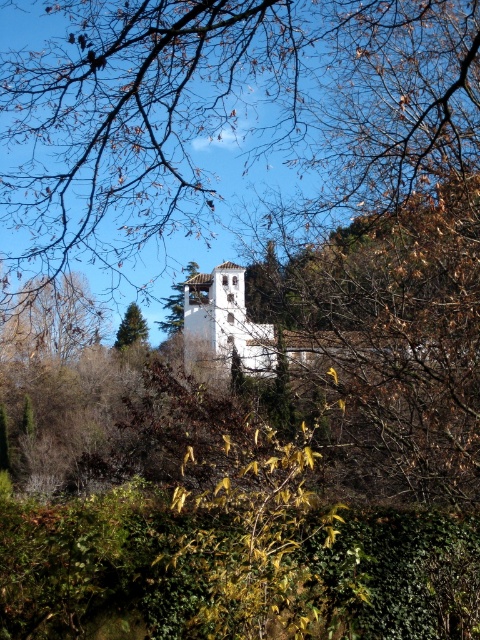
Question: Can you confirm if brown leafy tree at center is positioned to the right of green textured pine tree at center?

Choices:
 (A) yes
 (B) no

Answer: (A)

Question: Which point is farther from the camera taking this photo?

Choices:
 (A) click(136, 316)
 (B) click(172, 109)

Answer: (A)

Question: Among these points, which one is farthest from the camera?

Choices:
 (A) (343, 24)
 (B) (130, 333)
 (C) (239, 310)
 (D) (188, 272)

Answer: (B)

Question: Is brown leafy tree at center closer to camera compared to white stucco bell tower at center?

Choices:
 (A) no
 (B) yes

Answer: (B)

Question: Which point appears farthest from the camera in this image?

Choices:
 (A) (180, 300)
 (B) (248, 369)
 (C) (106, 138)
 (D) (136, 330)

Answer: (A)

Question: Does smooth white tower at center have a smaller size compared to green textured pine tree at center?

Choices:
 (A) yes
 (B) no

Answer: (B)